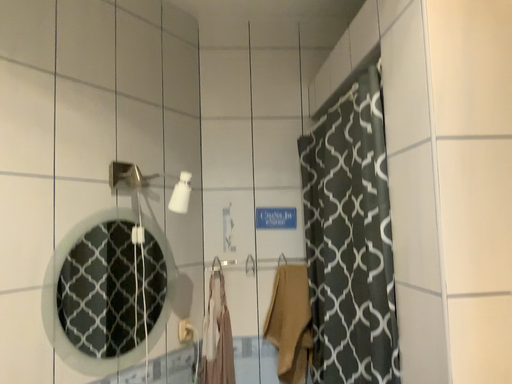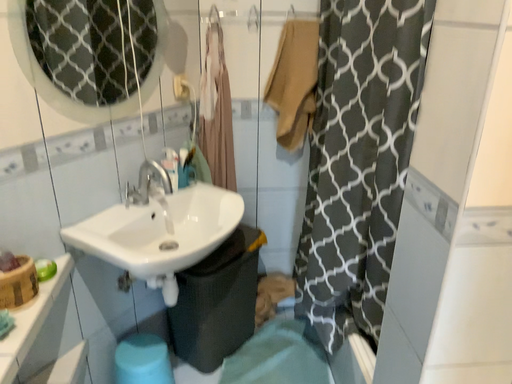
Question: Which way did the camera rotate in the video?

Choices:
 (A) rotated downward
 (B) rotated upward

Answer: (A)